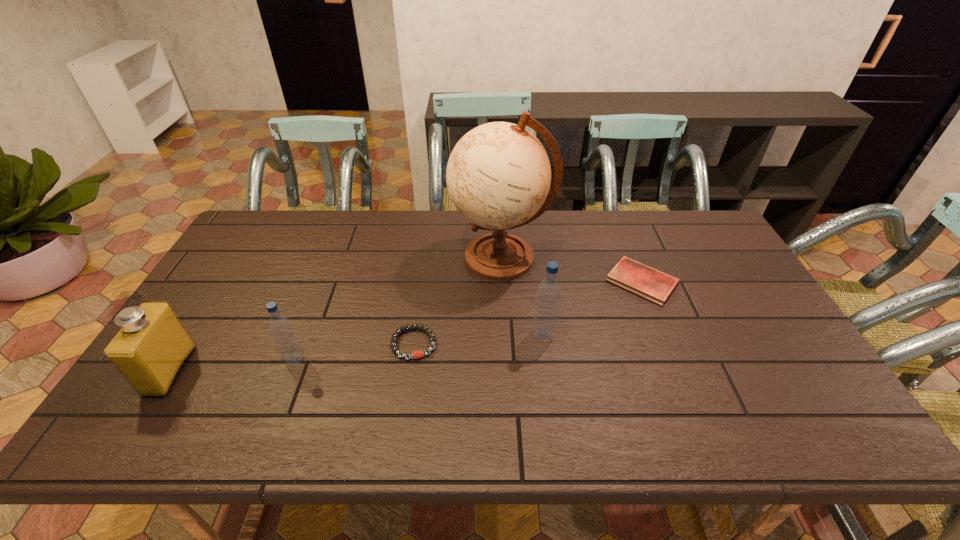
Identify the location of vacant region located 0.150m on the right of the farther water bottle. This screenshot has width=960, height=540. (611, 335).

Where is `vacant space located 0.380m on the left of the shortest object`? Image resolution: width=960 pixels, height=540 pixels. vacant space located 0.380m on the left of the shortest object is located at coordinates (481, 282).

The width and height of the screenshot is (960, 540). Find the location of `vacant area situated on the surface of the globe`. vacant area situated on the surface of the globe is located at coordinates (352, 258).

Image resolution: width=960 pixels, height=540 pixels. I want to click on vacant space located 0.220m on the surface of the globe, so click(383, 258).

Identify the location of vacant space positioned on the surface of the globe. (386, 258).

At what (x,y) coordinates should I click in order to perform the action: click on vacant space located on the front-facing side of the perfume. Please return your answer as a coordinate pair (x, y). The width and height of the screenshot is (960, 540). Looking at the image, I should click on (321, 371).

At what (x,y) coordinates should I click in order to perform the action: click on free space located 0.350m on the right of the third object from left to right. Please return your answer as a coordinate pair (x, y). The height and width of the screenshot is (540, 960). Looking at the image, I should click on (569, 343).

This screenshot has width=960, height=540. Find the location of `object that is at the far edge`. object that is at the far edge is located at coordinates pos(498,176).

This screenshot has height=540, width=960. I want to click on object present at the near edge, so click(x=151, y=348).

At what (x,y) coordinates should I click in order to perform the action: click on object positioned at the left edge. Please return your answer as a coordinate pair (x, y). Looking at the image, I should click on (151, 348).